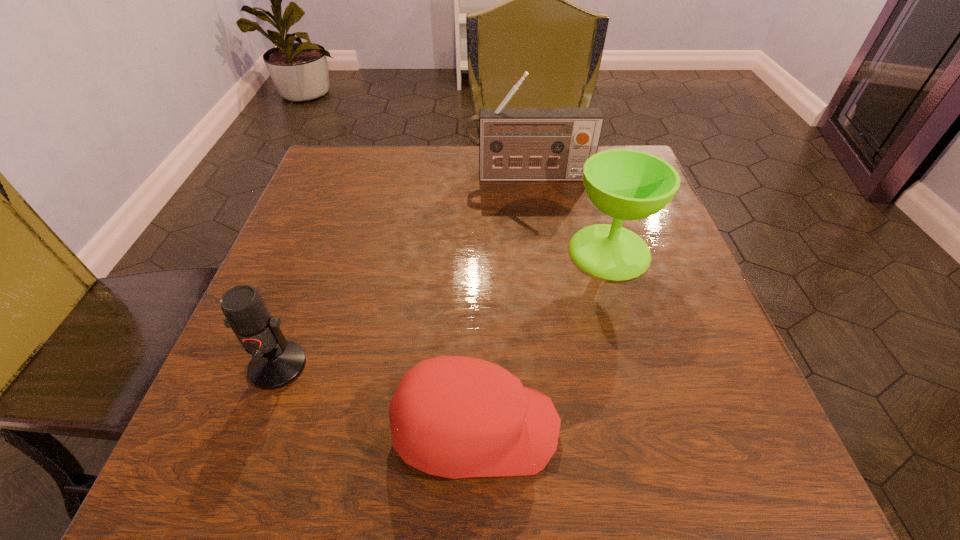
Locate an element on the screen. object located at the near edge is located at coordinates (457, 417).

You are a GUI agent. You are given a task and a screenshot of the screen. Output one action in this format:
    pyautogui.click(x=<x>, y=<y>)
    Task: Click on the object at the left edge
    The image size is (960, 540).
    Given the screenshot: What is the action you would take?
    pyautogui.click(x=276, y=362)

At what (x,y) coordinates should I click in order to perform the action: click on radio receiver present at the right edge. Please return your answer as a coordinate pair (x, y). This screenshot has width=960, height=540. Looking at the image, I should click on (515, 144).

This screenshot has height=540, width=960. Identify the location of wineglass that is positioned at the right edge. (626, 184).

Find the location of `object at the far right corner`. object at the far right corner is located at coordinates (515, 144).

Locate an element on the screen. vacant space at the far edge of the desktop is located at coordinates (564, 189).

Find the location of a particular element. The width and height of the screenshot is (960, 540). vacant position at the near edge of the desktop is located at coordinates (430, 478).

In the image, there is a desktop. At what (x,y) coordinates should I click in order to perform the action: click on free region at the left edge. Please return your answer as a coordinate pair (x, y). This screenshot has width=960, height=540. Looking at the image, I should click on (310, 312).

You are a GUI agent. You are given a task and a screenshot of the screen. Output one action in this format:
    pyautogui.click(x=<x>, y=<y>)
    Task: Click on the vacant space at the right edge
    This screenshot has height=540, width=960.
    Given the screenshot: What is the action you would take?
    pyautogui.click(x=657, y=228)

Find the location of a particular element. free point between the cap and the second farthest object is located at coordinates (542, 340).